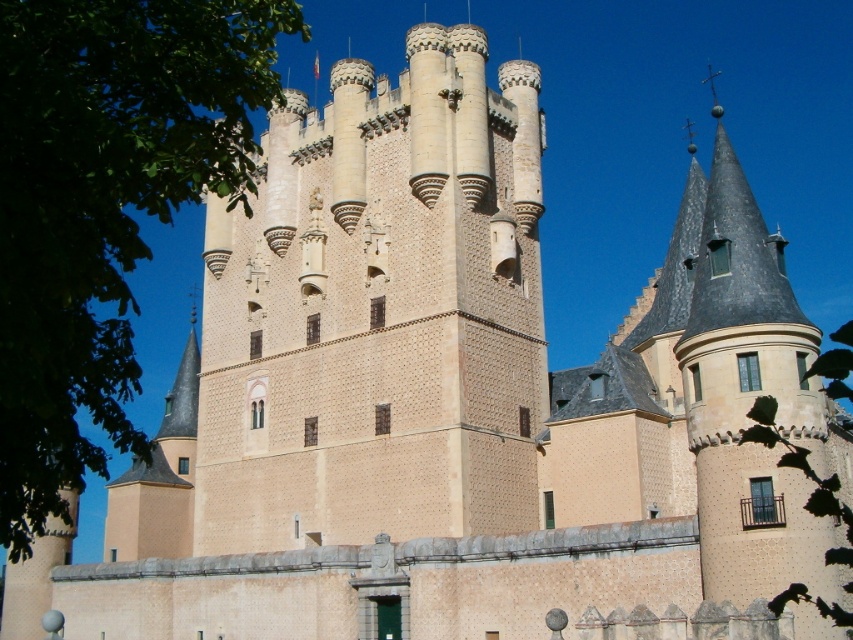
Looking at the medieval castle scene, there is a beige stone tower at center and a green leafy tree at upper left. From the perspective of someone standing in front of the castle, which object is positioned to the right of the other?

The beige stone tower at center is positioned to the right of the green leafy tree at upper left.

You are a knight standing at the base of the beige stone tower at center. You notice a green leafy tree at upper left in the distance. Your horse is 2 meters long. Can your horse comfortably gallop in a straight line from the tower to the tree without obstacles? Please consider the distance between them.

The distance between the beige stone tower at center and the green leafy tree at upper left is 18.28 meters. Since your horse is 2 meters long, it has enough space to comfortably gallop in a straight line between them as the distance is much greater than the horse length.

You are a drone operator trying to fly a drone between two points marked as point (473, 32). The drone has a wingspan of 1.2 meters. Can the drone safely pass through the space between these two points?

The distance between the two points (473, 32) is 66.59 meters. Since the drone has a wingspan of 1.2 meters, it can safely pass through the space as the distance is much larger than the wingspan.